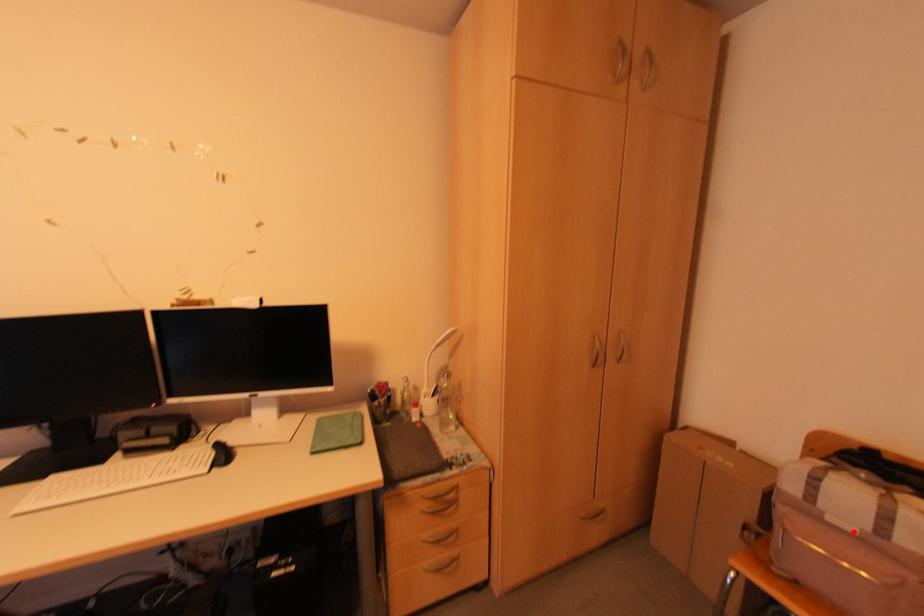
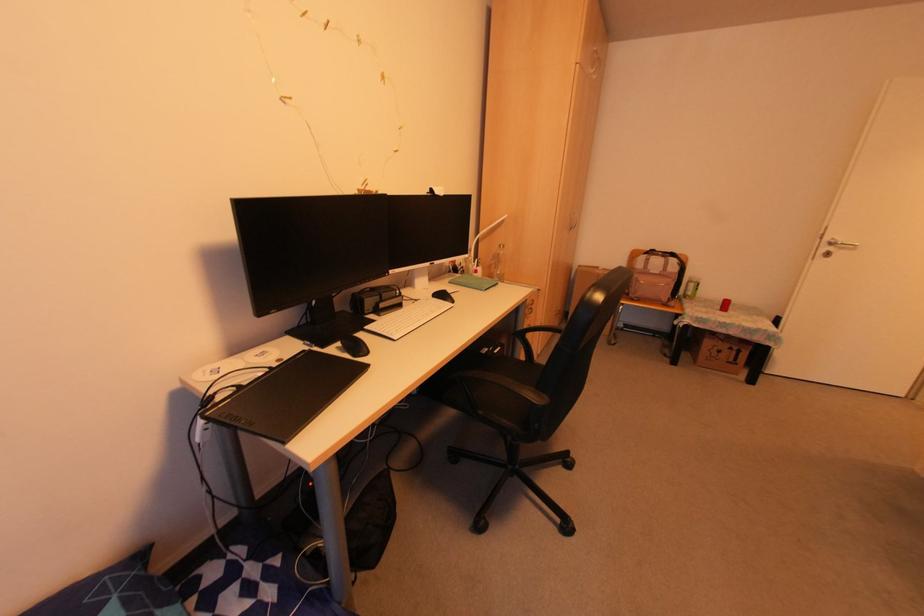
Question: I am providing you with two images of the same scene from different viewpoints. A red point is marked on the first image. Is the red point's position out of view in image 2?

Choices:
 (A) Yes
 (B) No

Answer: (B)